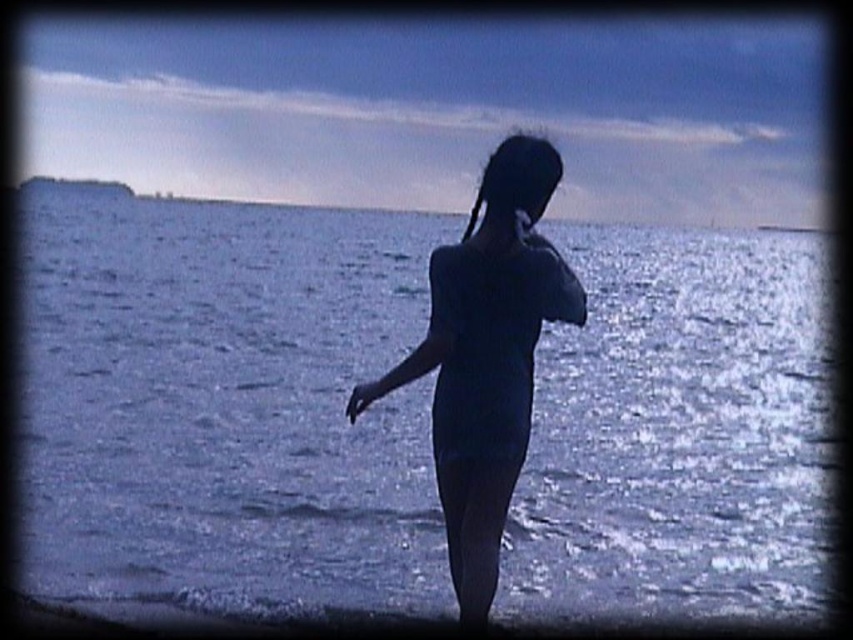
You are a photographer trying to capture the scene from the camera position. The blue water at center is at point (225, 404). Where should you aim your camera to include both the silhouette of the person and the blue water at center in the frame?

To include both the silhouette of the person and the blue water at center in the frame, aim your camera towards the blue water at center located at point (225, 404), as the person is positioned near the water edge facing away, likely within the same general area of the frame.

You are a photographer trying to capture the scene of the person by the water. You notice the blue water at center and the matte blue swimsuit at center. Which object is closer to your camera lens?

The blue water at center is closer to your camera lens because it is further to the viewer than the matte blue swimsuit at center.

You are a photographer trying to capture the person in the image. Since the blue water at center and the matte blue swimsuit at center are both blue, how can you ensure the swimsuit stands out in your photo?

The blue water at center is positioned over the matte blue swimsuit at center, so adjusting the camera angle to avoid the reflection might help the swimsuit stand out better.